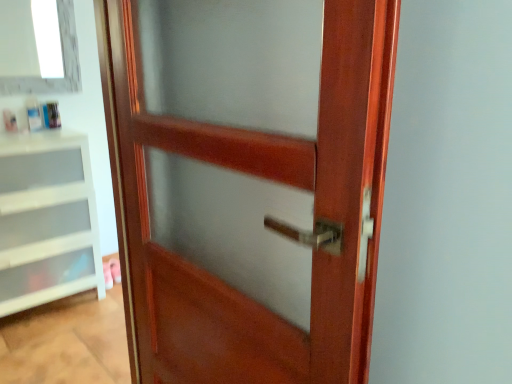
Question: Is white plastic drawer at left in front of or behind white glass window at upper left in the image?

Choices:
 (A) behind
 (B) front

Answer: (B)

Question: Considering the positions of white plastic drawer at left and white glass window at upper left in the image, is white plastic drawer at left taller or shorter than white glass window at upper left?

Choices:
 (A) short
 (B) tall

Answer: (B)

Question: Estimate the real-world distances between objects in this image. Which object is farther from the white plastic drawer at left?

Choices:
 (A) white glass window at upper left
 (B) mahogany wood door at center

Answer: (B)

Question: Considering the real-world distances, which object is farthest from the white plastic drawer at left?

Choices:
 (A) white glass window at upper left
 (B) mahogany wood door at center

Answer: (B)